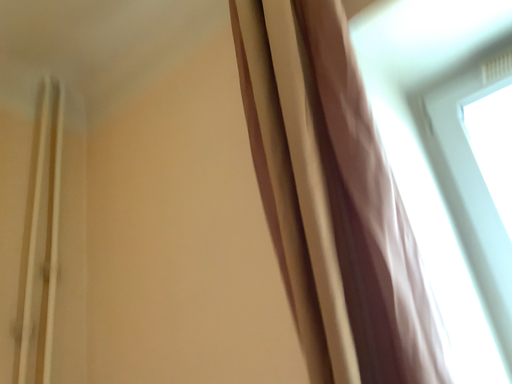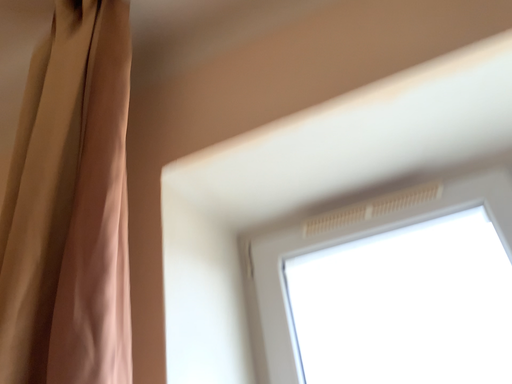
Question: Which way did the camera rotate in the video?

Choices:
 (A) rotated downward
 (B) rotated upward

Answer: (B)